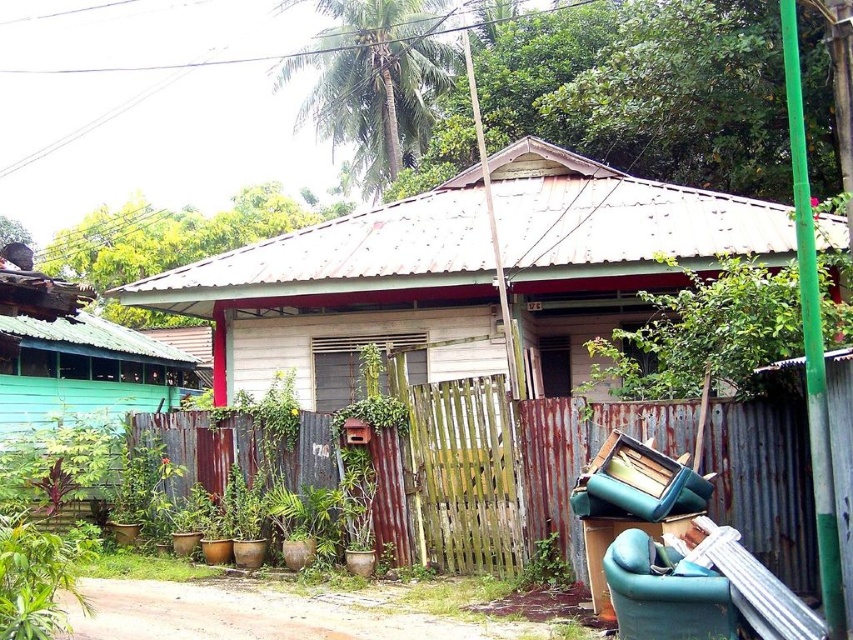
Consider the image. Does wooden hut at center have a greater height compared to green fabric armchair at lower right?

No.

Who is lower down, wooden hut at center or green fabric armchair at lower right?

green fabric armchair at lower right

The width and height of the screenshot is (853, 640). I want to click on wooden hut at center, so click(347, 296).

Is wooden hut at center above rusty metal fence at center?

Yes, wooden hut at center is above rusty metal fence at center.

Where is `wooden hut at center`? This screenshot has width=853, height=640. wooden hut at center is located at coordinates (347, 296).

From the picture: Between rusty metal fence at center and green fabric armchair at lower right, which one is positioned higher?

rusty metal fence at center is above.

Between rusty metal fence at center and green fabric armchair at lower right, which one has more height?

green fabric armchair at lower right

Identify the location of rusty metal fence at center. This screenshot has height=640, width=853. (560, 472).